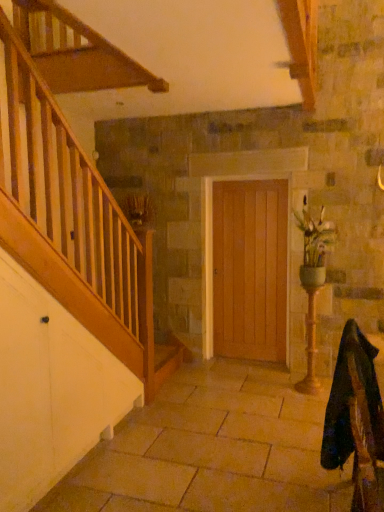
This screenshot has height=512, width=384. What do you see at coordinates (139, 210) in the screenshot?
I see `brown textured plant at upper left` at bounding box center [139, 210].

Measure the distance between brown textured plant at upper left and camera.

brown textured plant at upper left is 4.41 meters from camera.

This screenshot has width=384, height=512. What do you see at coordinates (314, 236) in the screenshot? I see `green ceramic vase at right` at bounding box center [314, 236].

I want to click on brown textured plant at upper left, so [139, 210].

Could you tell me if green ceramic vase at right is turned towards velvet dark green rocking chair at lower right?

Yes, green ceramic vase at right is oriented towards velvet dark green rocking chair at lower right.

What's the angular difference between green ceramic vase at right and velvet dark green rocking chair at lower right's facing directions?

The facing directions of green ceramic vase at right and velvet dark green rocking chair at lower right are 87 degrees apart.

Could velvet dark green rocking chair at lower right be considered to be inside green ceramic vase at right?

No.

Based on their sizes in the image, would you say green ceramic vase at right is bigger or smaller than velvet dark green rocking chair at lower right?

Clearly, green ceramic vase at right is smaller in size than velvet dark green rocking chair at lower right.

Considering the relative sizes of velvet dark green rocking chair at lower right and brown textured plant at upper left in the image provided, is velvet dark green rocking chair at lower right bigger than brown textured plant at upper left?

Indeed, velvet dark green rocking chair at lower right has a larger size compared to brown textured plant at upper left.

From the picture: Is velvet dark green rocking chair at lower right next to brown textured plant at upper left and touching it?

velvet dark green rocking chair at lower right is not next to brown textured plant at upper left, and they're not touching.

Is velvet dark green rocking chair at lower right looking in the opposite direction of brown textured plant at upper left?

velvet dark green rocking chair at lower right does not have its back to brown textured plant at upper left.

Is velvet dark green rocking chair at lower right far away from wooden door at center?

Indeed, velvet dark green rocking chair at lower right is not near wooden door at center.

Is velvet dark green rocking chair at lower right bigger than wooden door at center?

Indeed, velvet dark green rocking chair at lower right has a larger size compared to wooden door at center.

How different are the orientations of velvet dark green rocking chair at lower right and wooden door at center in degrees?

The angle between the facing direction of velvet dark green rocking chair at lower right and the facing direction of wooden door at center is 88.4 degrees.

Does velvet dark green rocking chair at lower right contain wooden door at center?

No.

Is brown textured plant at upper left not inside wooden door at center?

Yes, brown textured plant at upper left is not within wooden door at center.

Measure the distance from brown textured plant at upper left to wooden door at center.

They are 1.20 meters apart.

You are a GUI agent. You are given a task and a screenshot of the screen. Output one action in this format:
    pyautogui.click(x=<x>, y=<y>)
    Task: Click on the plant on the left of wooden door at center
    This screenshot has width=384, height=512.
    Given the screenshot: What is the action you would take?
    pyautogui.click(x=139, y=210)

Which of these two, brown textured plant at upper left or wooden door at center, is smaller?

brown textured plant at upper left.

From the image's perspective, which is below, velvet dark green rocking chair at lower right or green ceramic vase at right?

velvet dark green rocking chair at lower right, from the image's perspective.

Which of these two, velvet dark green rocking chair at lower right or green ceramic vase at right, stands taller?

Standing taller between the two is green ceramic vase at right.

Do you think velvet dark green rocking chair at lower right is within green ceramic vase at right, or outside of it?

velvet dark green rocking chair at lower right is not enclosed by green ceramic vase at right.

Measure the distance from green ceramic vase at right to wooden door at center.

30.29 inches.

Considering the positions of objects green ceramic vase at right and wooden door at center in the image provided, who is behind, green ceramic vase at right or wooden door at center?

Positioned behind is wooden door at center.

Looking at their sizes, would you say green ceramic vase at right is wider or thinner than wooden door at center?

green ceramic vase at right is wider than wooden door at center.

Considering the positions of point (305, 266) and point (270, 199), is point (305, 266) closer or farther from the camera than point (270, 199)?

Clearly, point (305, 266) is closer to the camera than point (270, 199).

Considering the positions of objects brown textured plant at upper left and green ceramic vase at right in the image provided, who is more to the left, brown textured plant at upper left or green ceramic vase at right?

Positioned to the left is brown textured plant at upper left.

Who is more distant, brown textured plant at upper left or green ceramic vase at right?

brown textured plant at upper left is further away from the camera.

Is brown textured plant at upper left looking in the opposite direction of green ceramic vase at right?

No, brown textured plant at upper left's orientation is not away from green ceramic vase at right.

Identify the location of rocking chair below the green ceramic vase at right (from a real-world perspective). This screenshot has height=512, width=384. click(x=355, y=418).

The image size is (384, 512). Find the location of `plant behind the velvet dark green rocking chair at lower right`. plant behind the velvet dark green rocking chair at lower right is located at coordinates (139, 210).

Based on their spatial positions, is brown textured plant at upper left or green ceramic vase at right further from wooden door at center?

Based on the image, brown textured plant at upper left appears to be further to wooden door at center.

From the picture: Considering their positions, is wooden door at center positioned further to green ceramic vase at right than brown textured plant at upper left?

Among the two, brown textured plant at upper left is located further to green ceramic vase at right.

Considering their positions, is green ceramic vase at right positioned further to velvet dark green rocking chair at lower right than brown textured plant at upper left?

brown textured plant at upper left is further to velvet dark green rocking chair at lower right.

Looking at the image, which one is located further to green ceramic vase at right, velvet dark green rocking chair at lower right or wooden door at center?

velvet dark green rocking chair at lower right is positioned further to the anchor green ceramic vase at right.

In the scene shown: Looking at the image, which one is located closer to velvet dark green rocking chair at lower right, wooden door at center or brown textured plant at upper left?

Based on the image, wooden door at center appears to be nearer to velvet dark green rocking chair at lower right.

Looking at the image, which one is located closer to brown textured plant at upper left, velvet dark green rocking chair at lower right or wooden door at center?

wooden door at center lies closer to brown textured plant at upper left than the other object.

Considering their positions, is velvet dark green rocking chair at lower right positioned closer to wooden door at center than green ceramic vase at right?

Among the two, green ceramic vase at right is located nearer to wooden door at center.

When comparing their distances from green ceramic vase at right, does brown textured plant at upper left or wooden door at center seem closer?

Among the two, wooden door at center is located nearer to green ceramic vase at right.

The width and height of the screenshot is (384, 512). What are the coordinates of `door positioned between velvet dark green rocking chair at lower right and brown textured plant at upper left from near to far` in the screenshot? It's located at (250, 269).

Identify the location of floral arrangement between velvet dark green rocking chair at lower right and wooden door at center in the front-back direction. This screenshot has height=512, width=384. (314, 236).

Locate an element on the screen. Image resolution: width=384 pixels, height=512 pixels. floral arrangement between velvet dark green rocking chair at lower right and brown textured plant at upper left in the front-back direction is located at coordinates (314, 236).

Locate an element on the screen. door located between brown textured plant at upper left and green ceramic vase at right in the left-right direction is located at coordinates (250, 269).